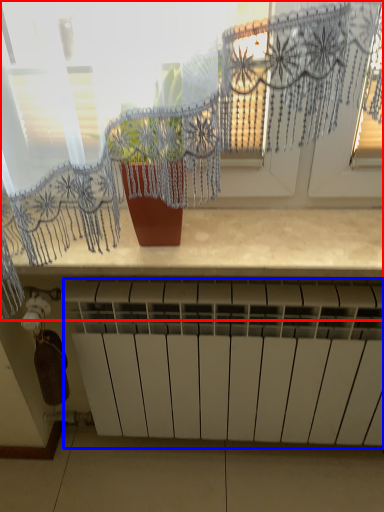
Question: Which object is further to the camera taking this photo, window (highlighted by a red box) or radiator (highlighted by a blue box)?

Choices:
 (A) window
 (B) radiator

Answer: (B)